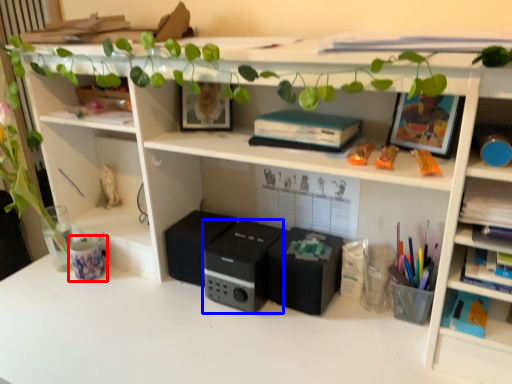
Question: Which object appears closest to the camera in this image, stationery (highlighted by a red box) or speaker (highlighted by a blue box)?

Choices:
 (A) stationery
 (B) speaker

Answer: (B)